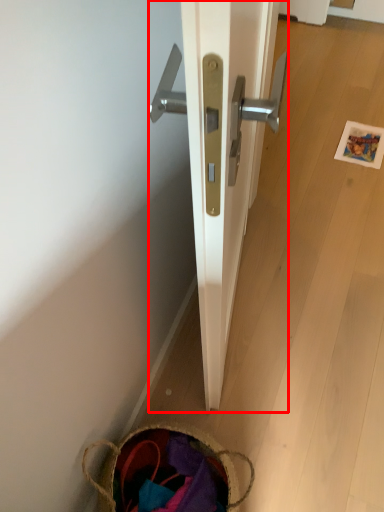
Question: From the image, what is the correct spatial relationship of door (annotated by the red box) in relation to basket?

Choices:
 (A) left
 (B) right

Answer: (B)